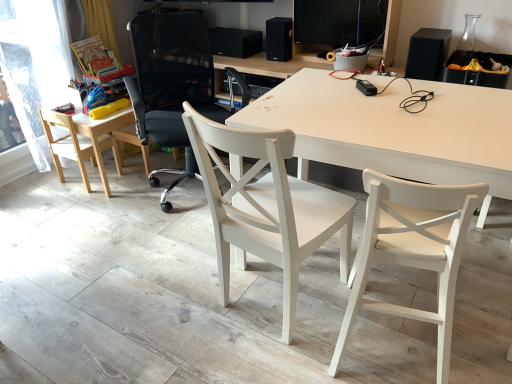
Question: From the image's perspective, is black matte speaker at upper right, the third speaker positioned from the left, above white matte chair at center, the 1th chair positioned from the right?

Choices:
 (A) no
 (B) yes

Answer: (B)

Question: Considering the relative sizes of black matte speaker at upper right, the third speaker positioned from the left, and white matte chair at center, placed as the 4th chair when sorted from left to right, in the image provided, is black matte speaker at upper right, the third speaker positioned from the left, shorter than white matte chair at center, placed as the 4th chair when sorted from left to right,?

Choices:
 (A) no
 (B) yes

Answer: (B)

Question: Is black matte speaker at upper right, which is the third speaker in back-to-front order, bigger than white matte chair at center, placed as the 4th chair when sorted from left to right?

Choices:
 (A) yes
 (B) no

Answer: (B)

Question: Is black matte speaker at upper right, which is counted as the first speaker, starting from the front, aimed at white matte chair at center, the 1th chair positioned from the right?

Choices:
 (A) yes
 (B) no

Answer: (A)

Question: Is white matte chair at center, the 1th chair positioned from the right, completely or partially inside black matte speaker at upper right, placed as the 1th speaker when sorted from right to left?

Choices:
 (A) no
 (B) yes

Answer: (A)

Question: Can we say black matte speaker at upper right, placed as the 1th speaker when sorted from right to left, lies outside white matte chair at center, placed as the 4th chair when sorted from left to right?

Choices:
 (A) yes
 (B) no

Answer: (A)

Question: Is black mesh office chair at center, acting as the second chair starting from the left, outside transparent plastic window screen at left?

Choices:
 (A) yes
 (B) no

Answer: (A)

Question: Are black mesh office chair at center, acting as the second chair starting from the left, and transparent plastic window screen at left located far from each other?

Choices:
 (A) yes
 (B) no

Answer: (B)

Question: Is black mesh office chair at center, acting as the second chair starting from the left, thinner than transparent plastic window screen at left?

Choices:
 (A) yes
 (B) no

Answer: (B)

Question: Considering the relative sizes of black mesh office chair at center, which is the third chair in right-to-left order, and transparent plastic window screen at left in the image provided, is black mesh office chair at center, which is the third chair in right-to-left order, shorter than transparent plastic window screen at left?

Choices:
 (A) no
 (B) yes

Answer: (B)

Question: Is the position of black mesh office chair at center, acting as the second chair starting from the left, more distant than that of transparent plastic window screen at left?

Choices:
 (A) yes
 (B) no

Answer: (B)

Question: From the image's perspective, is black mesh office chair at center, acting as the second chair starting from the left, over transparent plastic window screen at left?

Choices:
 (A) yes
 (B) no

Answer: (B)

Question: Can you confirm if white matte desk at center is bigger than black matte speaker at upper center, which is the second speaker from front to back?

Choices:
 (A) yes
 (B) no

Answer: (A)